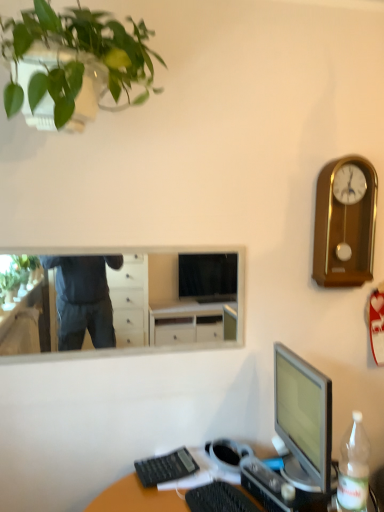
Question: Choose the correct answer: Is gold polished wood clock at upper right inside white glossy mirror at upper center or outside it?

Choices:
 (A) outside
 (B) inside

Answer: (A)

Question: In terms of size, does gold polished wood clock at upper right appear bigger or smaller than white glossy mirror at upper center?

Choices:
 (A) big
 (B) small

Answer: (A)

Question: Estimate the real-world distances between objects in this image. Which object is farther from the translucent plastic desk at lower right?

Choices:
 (A) black plastic keyboard at lower center, which is the second computer keyboard from right to left
 (B) black plastic keyboard at lower center, which is the 1th computer keyboard in right-to-left order
 (C) clear plastic bottle at lower right
 (D) gold polished wood clock at upper right
 (E) white glossy mirror at upper center

Answer: (E)

Question: Estimate the real-world distances between objects in this image. Which object is farther from the white glossy mirror at upper center?

Choices:
 (A) green matte plant at upper left
 (B) translucent plastic desk at lower right
 (C) gold polished wood clock at upper right
 (D) black plastic keyboard at lower center, which is the second computer keyboard from right to left
 (E) black plastic keyboard at lower center, which is the 1th computer keyboard in right-to-left order

Answer: (E)